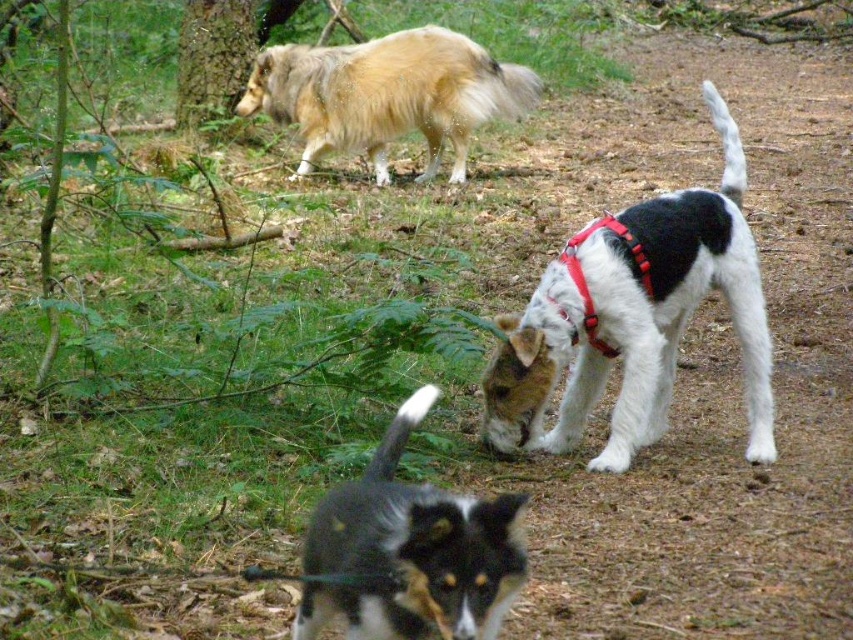
You are standing at the camera position and want to throw a treat to the nearest point between point (x=619, y=353) and point (x=341, y=52). Which point should you aim for?

Point (x=619, y=353) is closer to the camera than point (x=341, y=52), so you should aim for point (x=619, y=353).

You are a hiker trying to identify the dogs in the forest. According to the image, which dog is taller between the white fur with black spots at center and the black and white fur at lower center?

The white fur with black spots at center is taller than the black and white fur at lower center.

In the serene forest scene described, where the white fur with black spots at center and the golden fur dog at upper left are both present, which dog is positioned to the right of the other?

The white fur with black spots at center is positioned to the right of the golden fur dog at upper left.